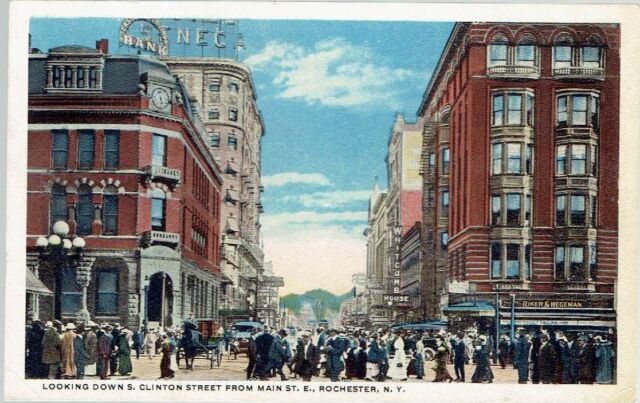
This screenshot has height=403, width=640. Find the location of `door way`. door way is located at coordinates (156, 296).